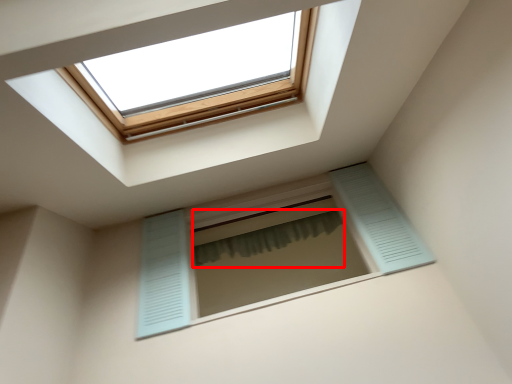
Question: From the image's perspective, where is shower curtain (annotated by the red box) located relative to window?

Choices:
 (A) below
 (B) above

Answer: (B)